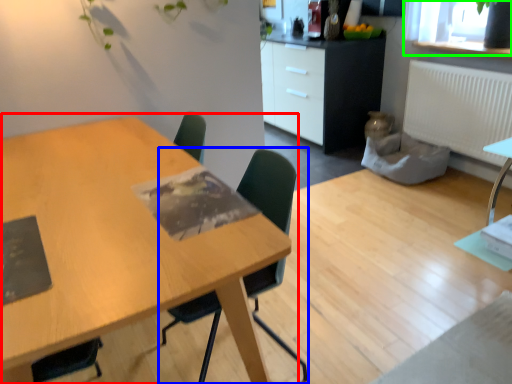
Question: Which object is positioned farthest from table (highlighted by a red box)? Select from chair (highlighted by a blue box) and window screen (highlighted by a green box).

Choices:
 (A) chair
 (B) window screen

Answer: (B)